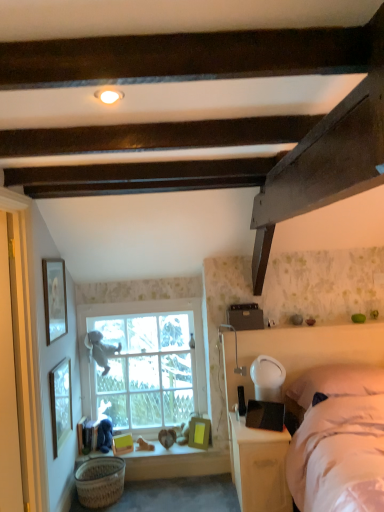
Question: Does wooden picture frame at left, arranged as the 2th picture frame when viewed from the top, have a greater width compared to matte gold picture frame at lower center, which appears as the third picture frame when viewed from the top?

Choices:
 (A) yes
 (B) no

Answer: (B)

Question: Is the surface of wooden picture frame at left, arranged as the 2th picture frame when viewed from the top, in direct contact with matte gold picture frame at lower center, the first picture frame in the right-to-left sequence?

Choices:
 (A) no
 (B) yes

Answer: (A)

Question: Considering the relative positions of wooden picture frame at left, arranged as the 2th picture frame when viewed from the top, and matte gold picture frame at lower center, which is the third picture frame in bottom-to-top order, in the image provided, is wooden picture frame at left, arranged as the 2th picture frame when viewed from the top, to the right of matte gold picture frame at lower center, which is the third picture frame in bottom-to-top order, from the viewer's perspective?

Choices:
 (A) no
 (B) yes

Answer: (A)

Question: Is wooden picture frame at left, arranged as the 2th picture frame when viewed from the top, aimed at matte gold picture frame at lower center, which appears as the third picture frame when viewed from the top?

Choices:
 (A) yes
 (B) no

Answer: (A)

Question: Is wooden picture frame at left, the fourth picture frame viewed from the right, thinner than matte gold picture frame at lower center, which appears as the third picture frame when viewed from the top?

Choices:
 (A) no
 (B) yes

Answer: (B)

Question: Do you think white glossy nightstand at lower right is within wooden picture frame at lower left, acting as the 2th picture frame starting from the bottom, or outside of it?

Choices:
 (A) inside
 (B) outside

Answer: (B)

Question: From the image's perspective, relative to wooden picture frame at lower left, which is the third picture frame in right-to-left order, is white glossy nightstand at lower right above or below?

Choices:
 (A) above
 (B) below

Answer: (A)

Question: From a real-world perspective, is white glossy nightstand at lower right above or below wooden picture frame at lower left, acting as the 2th picture frame starting from the bottom?

Choices:
 (A) below
 (B) above

Answer: (A)

Question: Considering the positions of white glossy nightstand at lower right and wooden picture frame at lower left, placed as the fourth picture frame when sorted from top to bottom, in the image, is white glossy nightstand at lower right taller or shorter than wooden picture frame at lower left, placed as the fourth picture frame when sorted from top to bottom,?

Choices:
 (A) short
 (B) tall

Answer: (B)

Question: In the image, is white fabric bed at right positioned in front of or behind wooden picture frame at lower left, acting as the 2th picture frame starting from the bottom?

Choices:
 (A) front
 (B) behind

Answer: (A)

Question: Is white fabric bed at right bigger or smaller than wooden picture frame at lower left, placed as the fourth picture frame when sorted from top to bottom?

Choices:
 (A) big
 (B) small

Answer: (A)

Question: In terms of height, does white fabric bed at right look taller or shorter compared to wooden picture frame at lower left, the third picture frame from the left?

Choices:
 (A) tall
 (B) short

Answer: (A)

Question: From a real-world perspective, is white fabric bed at right above or below wooden picture frame at lower left, placed as the fourth picture frame when sorted from top to bottom?

Choices:
 (A) above
 (B) below

Answer: (A)

Question: From a real-world perspective, is woven brown basket at lower left above or below matte white picture frame at upper left, the 5th picture frame when ordered from bottom to top?

Choices:
 (A) below
 (B) above

Answer: (A)

Question: Considering the positions of point (107, 474) and point (66, 304), is point (107, 474) closer or farther from the camera than point (66, 304)?

Choices:
 (A) farther
 (B) closer

Answer: (B)